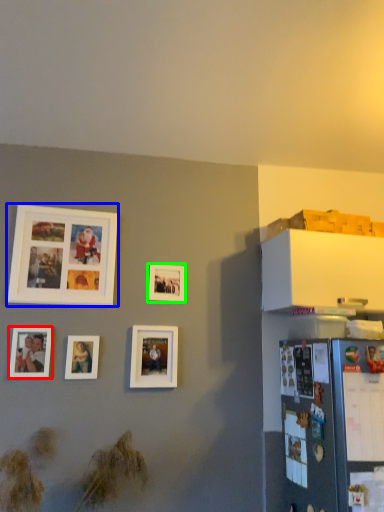
Question: Which object is positioned farthest from picture frame (highlighted by a red box)? Select from picture frame (highlighted by a blue box) and picture frame (highlighted by a green box).

Choices:
 (A) picture frame
 (B) picture frame

Answer: (B)